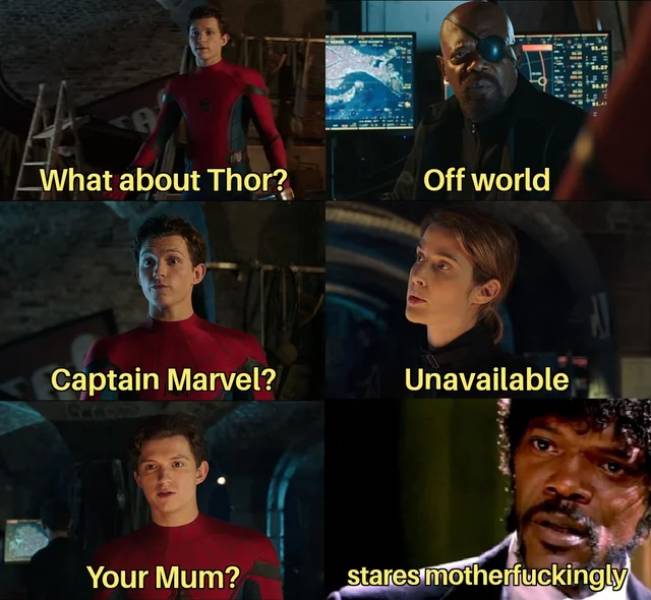
Image resolution: width=651 pixels, height=600 pixels. I want to click on computer screen, so click(x=378, y=83), click(x=559, y=70), click(x=32, y=541).